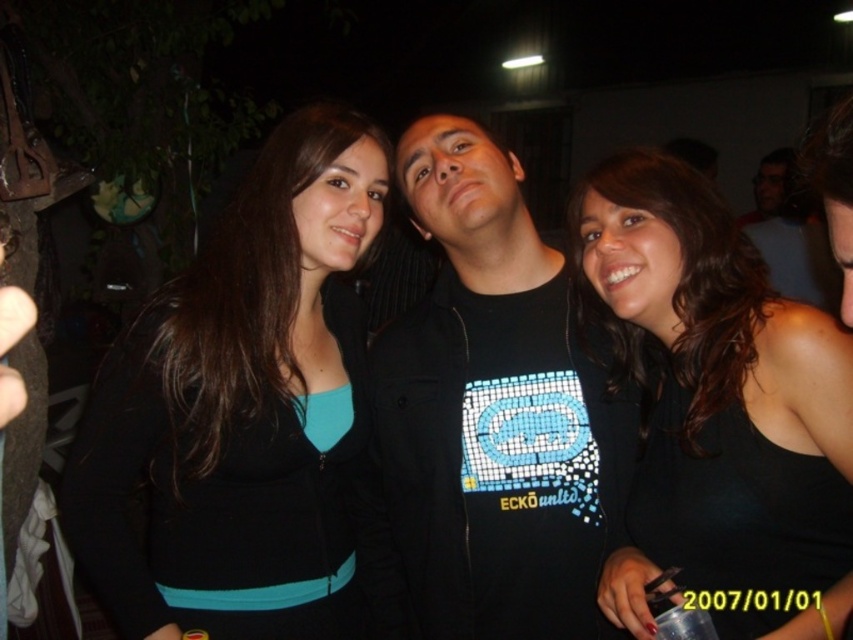
Can you confirm if black matte shirt at center is wider than black matte tank top at center?

Correct, the width of black matte shirt at center exceeds that of black matte tank top at center.

Which is more to the left, black matte shirt at center or black matte tank top at center?

From the viewer's perspective, black matte shirt at center appears more on the left side.

This screenshot has height=640, width=853. In order to click on black matte shirt at center in this screenshot , I will do `click(494, 412)`.

Is black matte jacket at left above black matte tank top at center?

Yes, black matte jacket at left is above black matte tank top at center.

Does black matte jacket at left have a larger size compared to black matte tank top at center?

Correct, black matte jacket at left is larger in size than black matte tank top at center.

Where is `black matte jacket at left`? This screenshot has width=853, height=640. black matte jacket at left is located at coordinates (245, 416).

Does point (123, 556) lie behind point (532, 324)?

That is False.

Who is shorter, black matte jacket at left or black matte shirt at center?

black matte shirt at center is shorter.

Is point (306, 244) farther from viewer compared to point (518, 516)?

Yes, it is.

I want to click on black matte jacket at left, so pos(245,416).